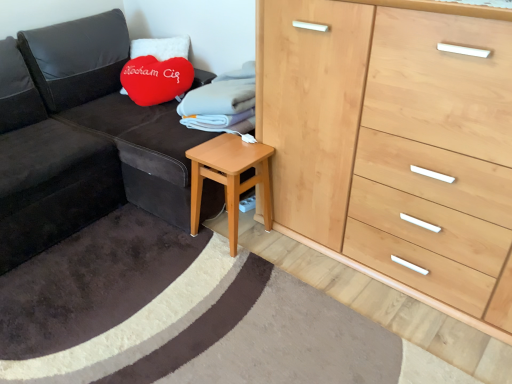
Describe the element at coordinates (395, 145) in the screenshot. This screenshot has height=384, width=512. I see `natural wood chest of drawers at right` at that location.

The image size is (512, 384). What do you see at coordinates (156, 79) in the screenshot?
I see `velvety red heart-shaped pillow at upper left` at bounding box center [156, 79].

Describe the element at coordinates (230, 178) in the screenshot. I see `light brown wooden stool at lower center` at that location.

Find the location of a particular element. The height and width of the screenshot is (384, 512). velvet dark gray couch at left is located at coordinates (81, 137).

Which is correct: natural wood chest of drawers at right is inside velvety red heart-shaped pillow at upper left, or outside of it?

The correct answer is: outside.

Is point (332, 109) closer to viewer compared to point (137, 91)?

That is True.

Is natural wood chest of drawers at right looking in the opposite direction of velvety red heart-shaped pillow at upper left?

No, natural wood chest of drawers at right is not facing away from velvety red heart-shaped pillow at upper left.

From a real-world perspective, is natural wood chest of drawers at right on top of velvety red heart-shaped pillow at upper left?

No, from a real-world perspective, natural wood chest of drawers at right is not on top of velvety red heart-shaped pillow at upper left.

Based on their positions, is velvety red heart-shaped pillow at upper left located to the left or right of natural wood chest of drawers at right?

In the image, velvety red heart-shaped pillow at upper left appears on the left side of natural wood chest of drawers at right.

In terms of width, does velvety red heart-shaped pillow at upper left look wider or thinner when compared to natural wood chest of drawers at right?

Clearly, velvety red heart-shaped pillow at upper left has less width compared to natural wood chest of drawers at right.

From the image's perspective, is velvety red heart-shaped pillow at upper left beneath natural wood chest of drawers at right?

Incorrect, from the image's perspective, velvety red heart-shaped pillow at upper left is higher than natural wood chest of drawers at right.

This screenshot has width=512, height=384. I want to click on throw pillow that appears on the left of natural wood chest of drawers at right, so click(x=156, y=79).

Is light brown wooden stool at lower center completely or partially inside natural wood chest of drawers at right?

That's incorrect, light brown wooden stool at lower center is not inside natural wood chest of drawers at right.

Considering the relative sizes of natural wood chest of drawers at right and light brown wooden stool at lower center in the image provided, is natural wood chest of drawers at right wider than light brown wooden stool at lower center?

Yes, natural wood chest of drawers at right is wider than light brown wooden stool at lower center.

In the scene shown: What's the angular difference between natural wood chest of drawers at right and light brown wooden stool at lower center's facing directions?

1.71 degrees separate the facing orientations of natural wood chest of drawers at right and light brown wooden stool at lower center.

From their relative heights in the image, would you say velvety red heart-shaped pillow at upper left is taller or shorter than velvet dark gray couch at left?

Considering their sizes, velvety red heart-shaped pillow at upper left has less height than velvet dark gray couch at left.

Does point (132, 67) come behind point (69, 78)?

Yes, it is behind point (69, 78).

Is velvety red heart-shaped pillow at upper left bigger than velvet dark gray couch at left?

Actually, velvety red heart-shaped pillow at upper left might be smaller than velvet dark gray couch at left.

Consider the image. From the image's perspective, which one is positioned lower, velvety red heart-shaped pillow at upper left or velvet dark gray couch at left?

velvet dark gray couch at left is shown below in the image.

How different are the orientations of velvet dark gray couch at left and velvety red heart-shaped pillow at upper left in degrees?

The angle between the facing direction of velvet dark gray couch at left and the facing direction of velvety red heart-shaped pillow at upper left is 86.9 degrees.

Visually, is velvet dark gray couch at left positioned to the left or to the right of velvety red heart-shaped pillow at upper left?

Clearly, velvet dark gray couch at left is on the left of velvety red heart-shaped pillow at upper left in the image.

Is velvety red heart-shaped pillow at upper left located within velvet dark gray couch at left?

Yes, velvet dark gray couch at left is surrounding velvety red heart-shaped pillow at upper left.

From the picture: From a real-world perspective, which is physically above, velvet dark gray couch at left or velvety red heart-shaped pillow at upper left?

In real-world perspective, velvety red heart-shaped pillow at upper left is above.

Is velvety red heart-shaped pillow at upper left oriented away from light brown wooden stool at lower center?

No, velvety red heart-shaped pillow at upper left's orientation is not away from light brown wooden stool at lower center.

In order to click on table on the right of the velvety red heart-shaped pillow at upper left in this screenshot , I will do `click(230, 178)`.

From the image's perspective, is velvety red heart-shaped pillow at upper left located above or below light brown wooden stool at lower center?

velvety red heart-shaped pillow at upper left is situated higher than light brown wooden stool at lower center in the image.

Considering the positions of objects velvety red heart-shaped pillow at upper left and light brown wooden stool at lower center in the image provided, who is more to the right, velvety red heart-shaped pillow at upper left or light brown wooden stool at lower center?

light brown wooden stool at lower center.

In terms of width, does light brown wooden stool at lower center look wider or thinner when compared to velvet dark gray couch at left?

Clearly, light brown wooden stool at lower center has less width compared to velvet dark gray couch at left.

Does light brown wooden stool at lower center come in front of velvet dark gray couch at left?

No, light brown wooden stool at lower center is further to the viewer.

Is light brown wooden stool at lower center oriented away from velvet dark gray couch at left?

No, velvet dark gray couch at left is not at the back of light brown wooden stool at lower center.

The width and height of the screenshot is (512, 384). I want to click on throw pillow behind the natural wood chest of drawers at right, so click(156, 79).

Find the location of a particular element. Image resolution: width=512 pixels, height=384 pixels. chest of drawers below the velvety red heart-shaped pillow at upper left (from a real-world perspective) is located at coordinates (395, 145).

In the scene shown: Estimate the real-world distances between objects in this image. Which object is closer to light brown wooden stool at lower center, velvet dark gray couch at left or velvety red heart-shaped pillow at upper left?

velvet dark gray couch at left is positioned closer to the anchor light brown wooden stool at lower center.

Which object lies further to the anchor point velvety red heart-shaped pillow at upper left, velvet dark gray couch at left or natural wood chest of drawers at right?

natural wood chest of drawers at right is further to velvety red heart-shaped pillow at upper left.

Based on their spatial positions, is light brown wooden stool at lower center or velvety red heart-shaped pillow at upper left closer to velvet dark gray couch at left?

velvety red heart-shaped pillow at upper left lies closer to velvet dark gray couch at left than the other object.

From the image, which object appears to be nearer to natural wood chest of drawers at right, velvet dark gray couch at left or velvety red heart-shaped pillow at upper left?

velvet dark gray couch at left is positioned closer to the anchor natural wood chest of drawers at right.

Considering their positions, is velvety red heart-shaped pillow at upper left positioned further to light brown wooden stool at lower center than velvet dark gray couch at left?

velvety red heart-shaped pillow at upper left.

From the image, which object appears to be nearer to natural wood chest of drawers at right, light brown wooden stool at lower center or velvety red heart-shaped pillow at upper left?

light brown wooden stool at lower center is closer to natural wood chest of drawers at right.

Which object lies further to the anchor point velvety red heart-shaped pillow at upper left, light brown wooden stool at lower center or natural wood chest of drawers at right?

Based on the image, natural wood chest of drawers at right appears to be further to velvety red heart-shaped pillow at upper left.

From the image, which object appears to be nearer to natural wood chest of drawers at right, velvety red heart-shaped pillow at upper left or velvet dark gray couch at left?

velvet dark gray couch at left is closer to natural wood chest of drawers at right.

Where is `throw pillow between velvet dark gray couch at left and natural wood chest of drawers at right in the horizontal direction`? The height and width of the screenshot is (384, 512). throw pillow between velvet dark gray couch at left and natural wood chest of drawers at right in the horizontal direction is located at coordinates (156, 79).

Identify the location of table between natural wood chest of drawers at right and velvety red heart-shaped pillow at upper left in the front-back direction. (230, 178).

Identify the location of studio couch between velvety red heart-shaped pillow at upper left and light brown wooden stool at lower center from top to bottom. (81, 137).

Find the location of a particular element. The image size is (512, 384). table situated between velvet dark gray couch at left and natural wood chest of drawers at right from left to right is located at coordinates (230, 178).